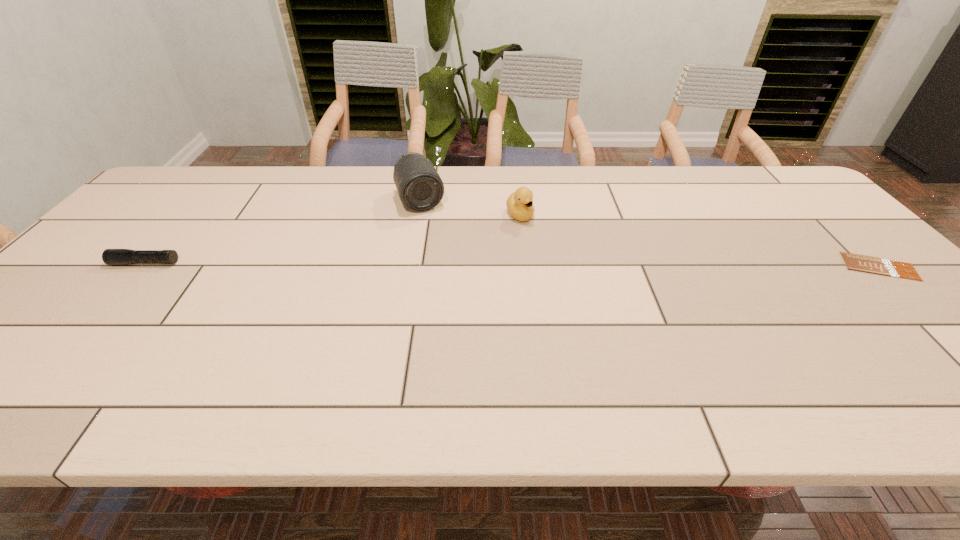
In order to click on blank space located on the surface of the third object from right to left in this screenshot , I will do `click(458, 291)`.

Locate an element on the screen. vacant space located on the surface of the third object from right to left is located at coordinates (448, 267).

Where is `vacant space located 0.340m on the surface of the third object from right to left`? This screenshot has height=540, width=960. vacant space located 0.340m on the surface of the third object from right to left is located at coordinates (458, 291).

Find the location of `free location located on the face of the duckling`. free location located on the face of the duckling is located at coordinates (589, 303).

You are a GUI agent. You are given a task and a screenshot of the screen. Output one action in this format:
    pyautogui.click(x=<x>, y=<y>)
    Task: Click on the vacant space located 0.360m on the face of the duckling
    This screenshot has width=960, height=540.
    Given the screenshot: What is the action you would take?
    pyautogui.click(x=594, y=308)

Identify the location of vacant space located 0.280m on the face of the duckling. This screenshot has width=960, height=540. (576, 287).

Locate an element on the screen. The width and height of the screenshot is (960, 540). object located in the far edge section of the desktop is located at coordinates (420, 188).

Where is `object located in the left edge section of the desktop`? The width and height of the screenshot is (960, 540). object located in the left edge section of the desktop is located at coordinates pyautogui.click(x=109, y=256).

You are a GUI agent. You are given a task and a screenshot of the screen. Output one action in this format:
    pyautogui.click(x=<x>, y=<y>)
    Task: Click on the object located in the right edge section of the desktop
    This screenshot has height=540, width=960.
    Given the screenshot: What is the action you would take?
    pyautogui.click(x=868, y=264)

Where is `vacant space at the far edge`? vacant space at the far edge is located at coordinates (256, 195).